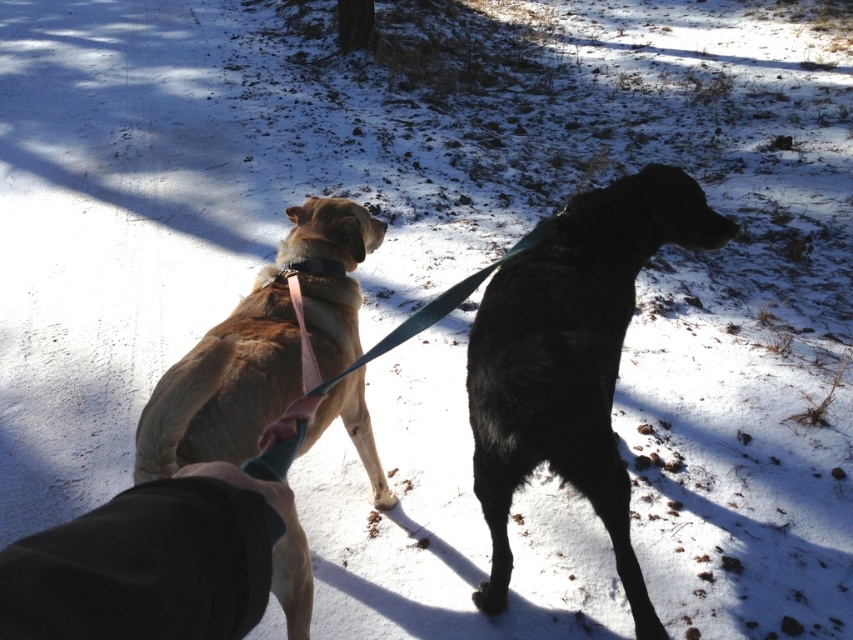
Question: Can you confirm if black fur dog at right is positioned above pink fabric neckband at upper center?

Choices:
 (A) no
 (B) yes

Answer: (A)

Question: Which object is farther from the camera taking this photo?

Choices:
 (A) black fabric pants at lower left
 (B) black fur dog at right
 (C) pink fabric neckband at upper center
 (D) golden fur dog at center

Answer: (C)

Question: Considering the relative positions of black fabric pants at lower left and pink fabric neckband at upper center in the image provided, where is black fabric pants at lower left located with respect to pink fabric neckband at upper center?

Choices:
 (A) above
 (B) below

Answer: (B)

Question: Is black fur dog at right bigger than black fabric pants at lower left?

Choices:
 (A) no
 (B) yes

Answer: (B)

Question: Which object is closer to the camera taking this photo?

Choices:
 (A) pink fabric neckband at upper center
 (B) golden fur dog at center

Answer: (B)

Question: Which of the following is the farthest from the observer?

Choices:
 (A) black fur dog at right
 (B) pink fabric neckband at upper center
 (C) black fabric pants at lower left

Answer: (B)